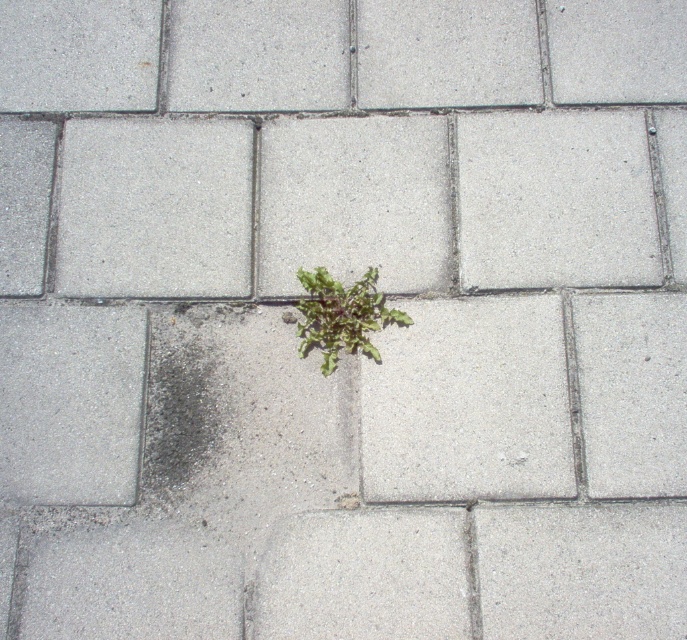
Can you confirm if dark gray gravel at center is wider than green leafy plant at center?

In fact, dark gray gravel at center might be narrower than green leafy plant at center.

Measure the distance between dark gray gravel at center and camera.

dark gray gravel at center is 1.49 meters from camera.

I want to click on dark gray gravel at center, so click(x=188, y=404).